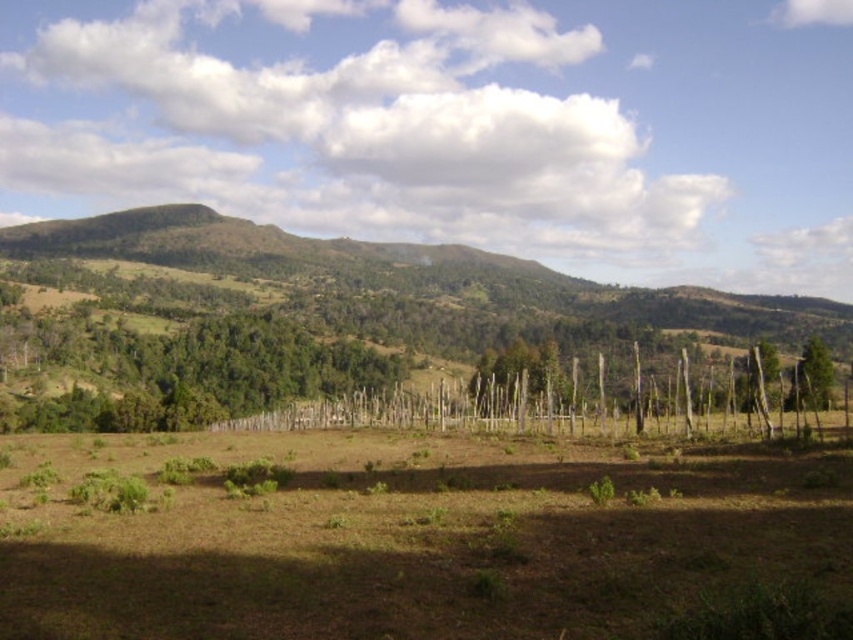
Question: Can you confirm if brown grassy field at center is positioned to the left of green rough bark tree at right?

Choices:
 (A) yes
 (B) no

Answer: (A)

Question: Among these objects, which one is nearest to the camera?

Choices:
 (A) brown grassy field at center
 (B) green rough bark tree at right

Answer: (A)

Question: Which object is farther from the camera taking this photo?

Choices:
 (A) green rough bark tree at right
 (B) brown grassy field at center

Answer: (A)

Question: Can you confirm if brown grassy field at center is thinner than green rough bark tree at right?

Choices:
 (A) no
 (B) yes

Answer: (B)

Question: Is brown grassy field at center positioned in front of green rough bark tree at right?

Choices:
 (A) yes
 (B) no

Answer: (A)